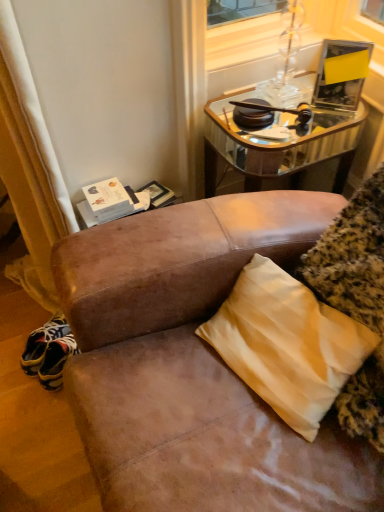
You are a GUI agent. You are given a task and a screenshot of the screen. Output one action in this format:
    pyautogui.click(x=<x>, y=<y>)
    Task: Click on the yellow satin pillow at lower right
    The height and width of the screenshot is (512, 384).
    Given the screenshot: What is the action you would take?
    pyautogui.click(x=287, y=344)

What do you see at coordinates (287, 344) in the screenshot?
I see `yellow satin pillow at lower right` at bounding box center [287, 344].

The image size is (384, 512). What do you see at coordinates (278, 145) in the screenshot?
I see `mirrored glass table at upper right` at bounding box center [278, 145].

The width and height of the screenshot is (384, 512). I want to click on mirrored glass table at upper right, so click(x=278, y=145).

What is the approximate width of mirrored glass table at upper right?

The width of mirrored glass table at upper right is 53.62 centimeters.

Where is `yellow satin pillow at lower right`? yellow satin pillow at lower right is located at coordinates (287, 344).

Which is more to the right, mirrored glass table at upper right or yellow satin pillow at lower right?

From the viewer's perspective, mirrored glass table at upper right appears more on the right side.

Considering the positions of objects mirrored glass table at upper right and yellow satin pillow at lower right in the image provided, who is behind, mirrored glass table at upper right or yellow satin pillow at lower right?

mirrored glass table at upper right is further away from the camera.

Does point (248, 91) lie behind point (328, 391)?

Yes, point (248, 91) is behind point (328, 391).

From the picture: From the image's perspective, is mirrored glass table at upper right beneath yellow satin pillow at lower right?

No.

Consider the image. From a real-world perspective, which object stands above the other?

From a 3D spatial view, yellow satin pillow at lower right is above.

Looking at their sizes, would you say mirrored glass table at upper right is wider or thinner than yellow satin pillow at lower right?

Clearly, mirrored glass table at upper right has more width compared to yellow satin pillow at lower right.

Between mirrored glass table at upper right and yellow satin pillow at lower right, which one has more height?

mirrored glass table at upper right is taller.

Considering the relative sizes of mirrored glass table at upper right and yellow satin pillow at lower right in the image provided, is mirrored glass table at upper right smaller than yellow satin pillow at lower right?

Actually, mirrored glass table at upper right might be larger than yellow satin pillow at lower right.

Could yellow satin pillow at lower right be considered to be inside mirrored glass table at upper right?

Definitely not — yellow satin pillow at lower right is not inside mirrored glass table at upper right.

Is the surface of mirrored glass table at upper right in direct contact with yellow satin pillow at lower right?

No.

Could you tell me if mirrored glass table at upper right is turned towards yellow satin pillow at lower right?

No, mirrored glass table at upper right is not oriented towards yellow satin pillow at lower right.

Measure the distance from mirrored glass table at upper right to yellow satin pillow at lower right.

They are 63.61 centimeters apart.

In the image, there is a mirrored glass table at upper right. Identify the location of pillow below it (from the image's perspective). (287, 344).

Which object is positioned more to the right, yellow satin pillow at lower right or mirrored glass table at upper right?

From the viewer's perspective, mirrored glass table at upper right appears more on the right side.

Which is in front, yellow satin pillow at lower right or mirrored glass table at upper right?

yellow satin pillow at lower right is closer to the camera.

Which is less distant, [336,356] or [215,116]?

The point [336,356] is in front.

From the image's perspective, which is below, yellow satin pillow at lower right or mirrored glass table at upper right?

yellow satin pillow at lower right is shown below in the image.

From a real-world perspective, between yellow satin pillow at lower right and mirrored glass table at upper right, who is vertically lower?

mirrored glass table at upper right, from a real-world perspective.

Between yellow satin pillow at lower right and mirrored glass table at upper right, which one has larger width?

Wider between the two is mirrored glass table at upper right.

In the scene shown: Which of these two, yellow satin pillow at lower right or mirrored glass table at upper right, stands taller?

Standing taller between the two is mirrored glass table at upper right.

Consider the image. Between yellow satin pillow at lower right and mirrored glass table at upper right, which one has larger size?

mirrored glass table at upper right is bigger.

Which is correct: yellow satin pillow at lower right is inside mirrored glass table at upper right, or outside of it?

yellow satin pillow at lower right cannot be found inside mirrored glass table at upper right.

Are yellow satin pillow at lower right and mirrored glass table at upper right far apart?

That's not correct — yellow satin pillow at lower right is a little close to mirrored glass table at upper right.

Does yellow satin pillow at lower right turn towards mirrored glass table at upper right?

No, yellow satin pillow at lower right is not facing towards mirrored glass table at upper right.

Measure the distance from yellow satin pillow at lower right to mirrored glass table at upper right.

The distance of yellow satin pillow at lower right from mirrored glass table at upper right is 63.61 centimeters.

Where is `pillow in front of the mirrored glass table at upper right`? The height and width of the screenshot is (512, 384). pillow in front of the mirrored glass table at upper right is located at coordinates (287, 344).

Image resolution: width=384 pixels, height=512 pixels. Identify the location of table located above the yellow satin pillow at lower right (from the image's perspective). (278, 145).

This screenshot has height=512, width=384. What are the coordinates of `pillow in front of the mirrored glass table at upper right` in the screenshot? It's located at (287, 344).